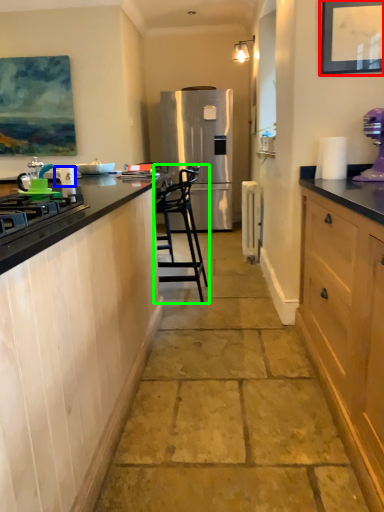
Question: Estimate the real-world distances between objects in this image. Which object is closer to picture frame (highlighted by a red box), appliance (highlighted by a blue box) or chair (highlighted by a green box)?

Choices:
 (A) appliance
 (B) chair

Answer: (A)